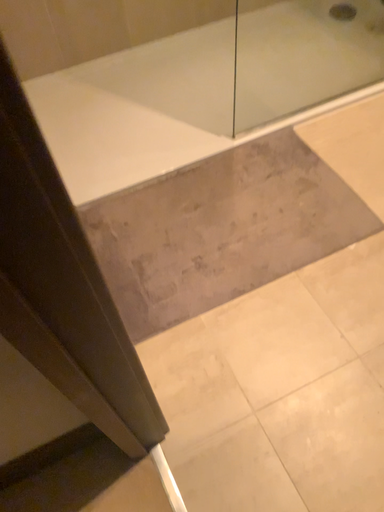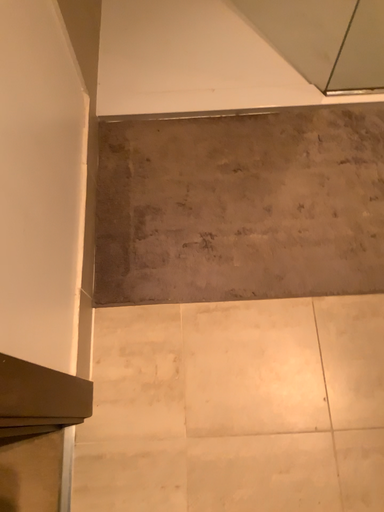
Question: How did the camera likely rotate when shooting the video?

Choices:
 (A) rotated upward
 (B) rotated downward

Answer: (B)